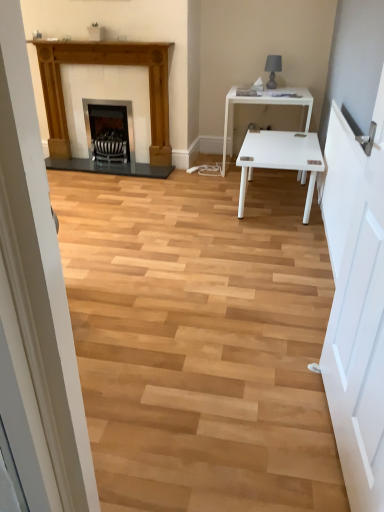
Question: Looking at their shapes, would you say wooden fireplace at left, the 2th fireplace from the right, is wider or thinner than white glossy table at center?

Choices:
 (A) thin
 (B) wide

Answer: (A)

Question: Looking at the image, does wooden fireplace at left, the 2th fireplace from the right, seem bigger or smaller compared to white glossy table at center?

Choices:
 (A) small
 (B) big

Answer: (A)

Question: Considering the real-world distances, which object is farthest from the white glossy table at center?

Choices:
 (A) white wooden door at right
 (B) matte black lamp at upper right
 (C) wooden fireplace at left, the 2th fireplace from the right
 (D) matte black fireplace at center, which appears as the first fireplace when viewed from the right

Answer: (A)

Question: Which object is positioned farthest from the wooden fireplace at left, the 2th fireplace from the right?

Choices:
 (A) matte black fireplace at center, which is the second fireplace from left to right
 (B) white glossy table at center
 (C) matte black lamp at upper right
 (D) white wooden door at right

Answer: (D)